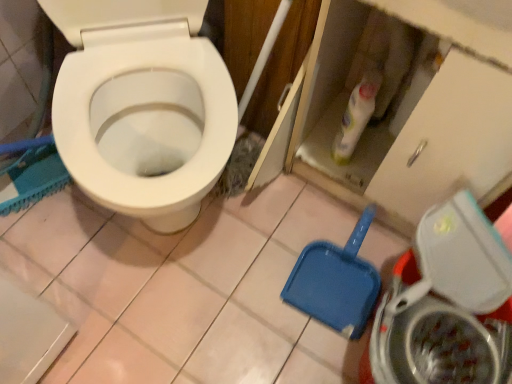
Question: Considering the positions of blue plastic shovel at lower right and white glossy bottle at upper center in the image, is blue plastic shovel at lower right wider or thinner than white glossy bottle at upper center?

Choices:
 (A) wide
 (B) thin

Answer: (A)

Question: In terms of size, does blue plastic shovel at lower right appear bigger or smaller than white glossy bottle at upper center?

Choices:
 (A) small
 (B) big

Answer: (B)

Question: Which object is positioned closest to the blue plastic shovel at lower right?

Choices:
 (A) white glossy bottle at upper center
 (B) metallic silver washing machine at lower right

Answer: (B)

Question: Based on their relative distances, which object is farther from the metallic silver washing machine at lower right?

Choices:
 (A) blue plastic shovel at lower right
 (B) white glossy bottle at upper center

Answer: (B)